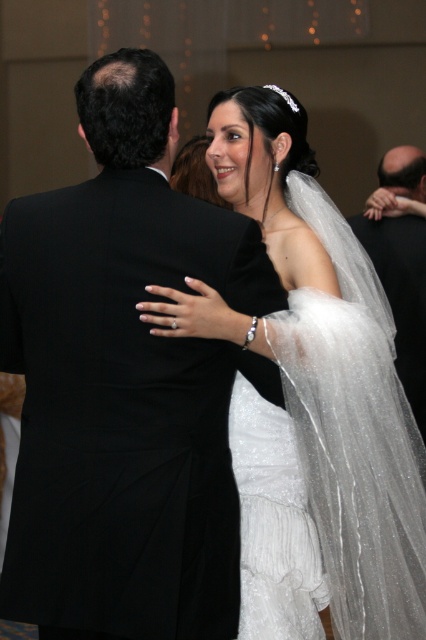
You are a photographer at a wedding reception. You want to capture a closeup shot of the bride and groom. The bride is on the right side of the frame, and the groom is on the left. The point at coordinate point (279, 500) is located between them. How far apart are the bride and groom?

The bride and groom are 5.98 feet apart.